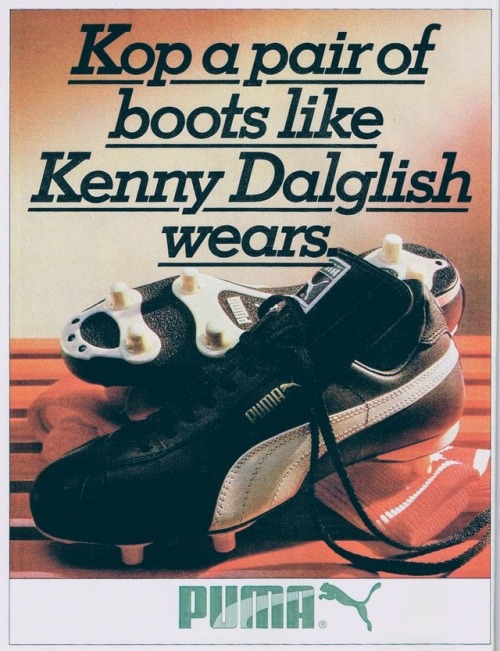
The image size is (500, 651). I want to click on wall, so click(x=359, y=225).